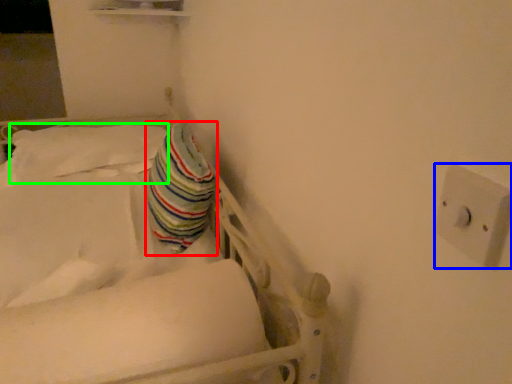
Question: Considering the real-world distances, which object is closest to throw pillow (highlighted by a red box)? electric outlet (highlighted by a blue box) or pillow (highlighted by a green box).

Choices:
 (A) electric outlet
 (B) pillow

Answer: (B)